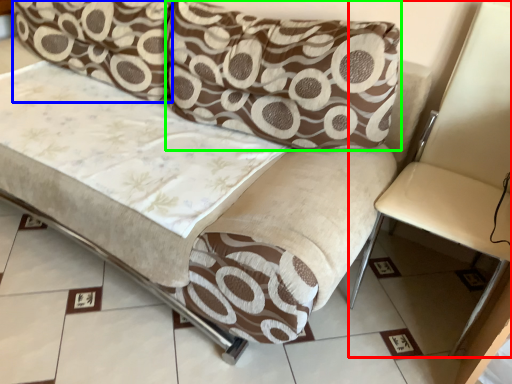
Question: Which object is positioned farthest from armchair (highlighted by a red box)? Select from pillow (highlighted by a blue box) and pillow (highlighted by a green box).

Choices:
 (A) pillow
 (B) pillow

Answer: (A)